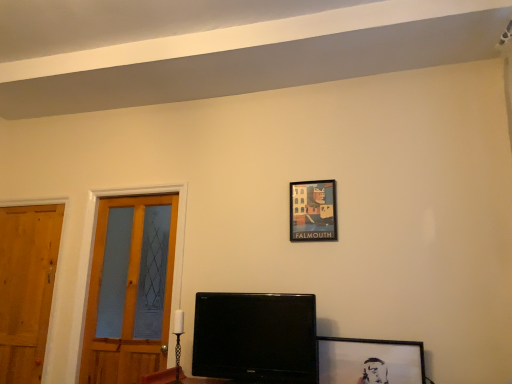
Question: From the image's perspective, is black glossy monitor at center on top of matte paper picture frame at upper center, the first picture frame from the back?

Choices:
 (A) yes
 (B) no

Answer: (B)

Question: Does black glossy monitor at center have a lesser height compared to matte paper picture frame at upper center, the first picture frame from the top?

Choices:
 (A) no
 (B) yes

Answer: (A)

Question: Is black glossy monitor at center directly adjacent to matte paper picture frame at upper center, the 2th picture frame in the front-to-back sequence?

Choices:
 (A) yes
 (B) no

Answer: (B)

Question: Can you confirm if black glossy monitor at center is bigger than matte paper picture frame at upper center, the first picture frame from the top?

Choices:
 (A) yes
 (B) no

Answer: (A)

Question: Is black glossy monitor at center to the right of matte paper picture frame at upper center, the 2th picture frame in the front-to-back sequence, from the viewer's perspective?

Choices:
 (A) no
 (B) yes

Answer: (A)

Question: In terms of width, does black matte picture frame at lower right, placed as the 1th picture frame when sorted from bottom to top, look wider or thinner when compared to wooden door at left, positioned as the first door in left-to-right order?

Choices:
 (A) wide
 (B) thin

Answer: (A)

Question: Considering the positions of black matte picture frame at lower right, which is the first picture frame from front to back, and wooden door at left, positioned as the first door in left-to-right order, in the image, is black matte picture frame at lower right, which is the first picture frame from front to back, bigger or smaller than wooden door at left, positioned as the first door in left-to-right order,?

Choices:
 (A) big
 (B) small

Answer: (B)

Question: Considering their positions, is black matte picture frame at lower right, which appears as the second picture frame when viewed from the top, located in front of or behind wooden door at left, positioned as the first door in left-to-right order?

Choices:
 (A) behind
 (B) front

Answer: (B)

Question: Choose the correct answer: Is black matte picture frame at lower right, which is the first picture frame from front to back, inside wooden door at left, the second door viewed from the right, or outside it?

Choices:
 (A) inside
 (B) outside

Answer: (B)

Question: Is black glossy monitor at center inside the boundaries of matte paper picture frame at upper center, the second picture frame ordered from the bottom, or outside?

Choices:
 (A) outside
 (B) inside

Answer: (A)

Question: From their relative heights in the image, would you say black glossy monitor at center is taller or shorter than matte paper picture frame at upper center, the first picture frame from the top?

Choices:
 (A) tall
 (B) short

Answer: (A)

Question: Looking at the image, does black glossy monitor at center seem bigger or smaller compared to matte paper picture frame at upper center, the 2th picture frame in the front-to-back sequence?

Choices:
 (A) big
 (B) small

Answer: (A)

Question: From a real-world perspective, is black glossy monitor at center physically located above or below matte paper picture frame at upper center, the first picture frame from the back?

Choices:
 (A) above
 (B) below

Answer: (B)

Question: Would you say wooden door at left, placed as the 2th door when sorted from left to right, is to the left or to the right of wooden door at left, positioned as the first door in left-to-right order, in the picture?

Choices:
 (A) left
 (B) right

Answer: (B)

Question: Is wooden door at left, which appears as the 1th door when viewed from the right, inside or outside of wooden door at left, positioned as the first door in left-to-right order?

Choices:
 (A) inside
 (B) outside

Answer: (B)